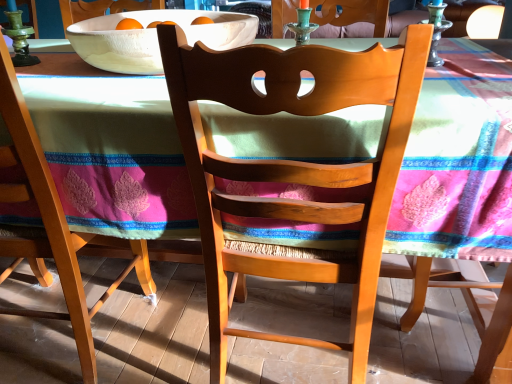
What do you see at coordinates (302, 23) in the screenshot? I see `green glass candle holder at upper center, placed as the first candle holder when sorted from left to right` at bounding box center [302, 23].

The width and height of the screenshot is (512, 384). What do you see at coordinates (51, 225) in the screenshot? I see `wooden chair at left, acting as the second chair starting from the right` at bounding box center [51, 225].

The height and width of the screenshot is (384, 512). Describe the element at coordinates (154, 38) in the screenshot. I see `white matte bowl at upper center` at that location.

The image size is (512, 384). I want to click on matte wood chair at center, the 2th chair viewed from the left, so click(x=293, y=169).

Is point (364, 192) positioned behind point (432, 4)?

No, it is in front of (432, 4).

Considering the sizes of objects textured cotton tablecloth at center and green glass candle holder at upper right, the second candle holder in the left-to-right sequence, in the image provided, who is thinner, textured cotton tablecloth at center or green glass candle holder at upper right, the second candle holder in the left-to-right sequence,?

green glass candle holder at upper right, the second candle holder in the left-to-right sequence, is thinner.

Is textured cotton tablecloth at center turned away from green glass candle holder at upper right, arranged as the 1th candle holder when viewed from the right?

No, textured cotton tablecloth at center is not facing the opposite direction of green glass candle holder at upper right, arranged as the 1th candle holder when viewed from the right.

Is textured cotton tablecloth at center spatially inside green glass candle holder at upper right, the second candle holder in the left-to-right sequence, or outside of it?

textured cotton tablecloth at center is not inside green glass candle holder at upper right, the second candle holder in the left-to-right sequence, it's outside.

Looking at the image, does green glass candle holder at upper center, placed as the first candle holder when sorted from left to right, seem bigger or smaller compared to textured cotton tablecloth at center?

In the image, green glass candle holder at upper center, placed as the first candle holder when sorted from left to right, appears to be smaller than textured cotton tablecloth at center.

Which object is wider, green glass candle holder at upper center, placed as the first candle holder when sorted from left to right, or textured cotton tablecloth at center?

Wider between the two is textured cotton tablecloth at center.

At what (x,y) coordinates should I click in order to perform the action: click on the 2nd candle holder behind the textured cotton tablecloth at center, starting your count from the anchor. Please return your answer as a coordinate pair (x, y). This screenshot has width=512, height=384. Looking at the image, I should click on (302, 23).

Considering the positions of points (303, 0) and (60, 170), is point (303, 0) farther from camera compared to point (60, 170)?

Yes, it is behind point (60, 170).

Is point (302, 264) positioned before point (189, 17)?

Yes, it is.

Is matte wood chair at center, which ranks as the 1th chair in right-to-left order, at the left side of white matte bowl at upper center?

No, matte wood chair at center, which ranks as the 1th chair in right-to-left order, is not to the left of white matte bowl at upper center.

How distant is matte wood chair at center, which ranks as the 1th chair in right-to-left order, from white matte bowl at upper center?

They are 19.60 inches apart.

Does matte wood chair at center, the 2th chair viewed from the left, have a greater height compared to white matte bowl at upper center?

Correct, matte wood chair at center, the 2th chair viewed from the left, is much taller as white matte bowl at upper center.

Is point (92, 374) closer or farther from the camera than point (438, 40)?

Point (92, 374).

From a real-world perspective, between wooden chair at left, acting as the second chair starting from the right, and green glass candle holder at upper right, arranged as the 1th candle holder when viewed from the right, who is vertically higher?

From a 3D spatial view, green glass candle holder at upper right, arranged as the 1th candle holder when viewed from the right, is above.

Could you tell me if wooden chair at left, which is the first chair in left-to-right order, is facing green glass candle holder at upper right, the second candle holder in the left-to-right sequence?

No, wooden chair at left, which is the first chair in left-to-right order, is not facing towards green glass candle holder at upper right, the second candle holder in the left-to-right sequence.

Is wooden chair at left, which is the first chair in left-to-right order, not close to white matte bowl at upper center?

wooden chair at left, which is the first chair in left-to-right order, is actually quite close to white matte bowl at upper center.

From a real-world perspective, starting from the white matte bowl at upper center, which chair is the 1st one below it? Please provide its 2D coordinates.

[(51, 225)]

From the picture: Would you say white matte bowl at upper center is part of wooden chair at left, which is the first chair in left-to-right order,'s contents?

That's incorrect, white matte bowl at upper center is not inside wooden chair at left, which is the first chair in left-to-right order.

Which of these two, wooden chair at left, which is the first chair in left-to-right order, or white matte bowl at upper center, is wider?

white matte bowl at upper center is wider.

In the scene shown: Is green glass candle holder at upper right, the second candle holder in the left-to-right sequence, located outside textured cotton tablecloth at center?

Yes, green glass candle holder at upper right, the second candle holder in the left-to-right sequence, is not within textured cotton tablecloth at center.

Which of these two, green glass candle holder at upper right, arranged as the 1th candle holder when viewed from the right, or textured cotton tablecloth at center, is thinner?

With smaller width is green glass candle holder at upper right, arranged as the 1th candle holder when viewed from the right.

Which object is positioned more to the left, green glass candle holder at upper right, the second candle holder in the left-to-right sequence, or textured cotton tablecloth at center?

From the viewer's perspective, textured cotton tablecloth at center appears more on the left side.

Which object is further away from the camera taking this photo, green glass candle holder at upper right, arranged as the 1th candle holder when viewed from the right, or textured cotton tablecloth at center?

green glass candle holder at upper right, arranged as the 1th candle holder when viewed from the right, is further from the camera.

From the image's perspective, is green glass candle holder at upper center, placed as the first candle holder when sorted from left to right, located above or below white matte bowl at upper center?

Clearly, from the image's perspective, green glass candle holder at upper center, placed as the first candle holder when sorted from left to right, is above white matte bowl at upper center.

Considering the sizes of objects green glass candle holder at upper center, placed as the first candle holder when sorted from left to right, and white matte bowl at upper center in the image provided, who is wider, green glass candle holder at upper center, placed as the first candle holder when sorted from left to right, or white matte bowl at upper center?

Wider between the two is white matte bowl at upper center.

Are green glass candle holder at upper center, placed as the first candle holder when sorted from left to right, and white matte bowl at upper center far apart?

That's not correct — green glass candle holder at upper center, placed as the first candle holder when sorted from left to right, is a little close to white matte bowl at upper center.

This screenshot has width=512, height=384. Identify the location of tablecloth lying below the green glass candle holder at upper right, arranged as the 1th candle holder when viewed from the right (from the image's perspective). (458, 161).

Image resolution: width=512 pixels, height=384 pixels. What are the coordinates of `tablecloth that is on the left side of green glass candle holder at upper center, placed as the first candle holder when sorted from left to right` in the screenshot? It's located at (458, 161).

Consider the image. Considering their positions, is green glass candle holder at upper right, the second candle holder in the left-to-right sequence, positioned further to white matte bowl at upper center than matte wood chair at center, which ranks as the 1th chair in right-to-left order?

green glass candle holder at upper right, the second candle holder in the left-to-right sequence, is further to white matte bowl at upper center.

Considering their positions, is textured cotton tablecloth at center positioned closer to green glass candle holder at upper center, which ranks as the 2th candle holder in right-to-left order, than white matte bowl at upper center?

The object closer to green glass candle holder at upper center, which ranks as the 2th candle holder in right-to-left order, is white matte bowl at upper center.

From the image, which object appears to be farther from green glass candle holder at upper right, arranged as the 1th candle holder when viewed from the right, textured cotton tablecloth at center or matte wood chair at center, which ranks as the 1th chair in right-to-left order?

Based on the image, matte wood chair at center, which ranks as the 1th chair in right-to-left order, appears to be further to green glass candle holder at upper right, arranged as the 1th candle holder when viewed from the right.

Which object lies further to the anchor point matte wood chair at center, which ranks as the 1th chair in right-to-left order, textured cotton tablecloth at center or green glass candle holder at upper right, the second candle holder in the left-to-right sequence?

green glass candle holder at upper right, the second candle holder in the left-to-right sequence, is further to matte wood chair at center, which ranks as the 1th chair in right-to-left order.

Which object lies nearer to the anchor point textured cotton tablecloth at center, green glass candle holder at upper center, which ranks as the 2th candle holder in right-to-left order, or green glass candle holder at upper right, the second candle holder in the left-to-right sequence?

Based on the image, green glass candle holder at upper center, which ranks as the 2th candle holder in right-to-left order, appears to be nearer to textured cotton tablecloth at center.

Based on their spatial positions, is textured cotton tablecloth at center or wooden chair at left, which is the first chair in left-to-right order, further from green glass candle holder at upper center, which ranks as the 2th candle holder in right-to-left order?

wooden chair at left, which is the first chair in left-to-right order, lies further to green glass candle holder at upper center, which ranks as the 2th candle holder in right-to-left order, than the other object.

Estimate the real-world distances between objects in this image. Which object is closer to white matte bowl at upper center, matte wood chair at center, which ranks as the 1th chair in right-to-left order, or wooden chair at left, which is the first chair in left-to-right order?

matte wood chair at center, which ranks as the 1th chair in right-to-left order, is positioned closer to the anchor white matte bowl at upper center.

Which object lies further to the anchor point matte wood chair at center, the 2th chair viewed from the left, green glass candle holder at upper right, arranged as the 1th candle holder when viewed from the right, or textured cotton tablecloth at center?

green glass candle holder at upper right, arranged as the 1th candle holder when viewed from the right, is further to matte wood chair at center, the 2th chair viewed from the left.

Image resolution: width=512 pixels, height=384 pixels. Identify the location of chair between wooden chair at left, acting as the second chair starting from the right, and green glass candle holder at upper center, placed as the first candle holder when sorted from left to right. (293, 169).

Identify the location of tablecloth situated between wooden chair at left, which is the first chair in left-to-right order, and matte wood chair at center, the 2th chair viewed from the left, from left to right. (458, 161).

Identify the location of chair located between white matte bowl at upper center and green glass candle holder at upper right, arranged as the 1th candle holder when viewed from the right, in the left-right direction. The height and width of the screenshot is (384, 512). pos(293,169).

This screenshot has height=384, width=512. Find the location of `bowl between green glass candle holder at upper center, which ranks as the 2th candle holder in right-to-left order, and matte wood chair at center, which ranks as the 1th chair in right-to-left order, in the up-down direction`. bowl between green glass candle holder at upper center, which ranks as the 2th candle holder in right-to-left order, and matte wood chair at center, which ranks as the 1th chair in right-to-left order, in the up-down direction is located at coordinates (154, 38).